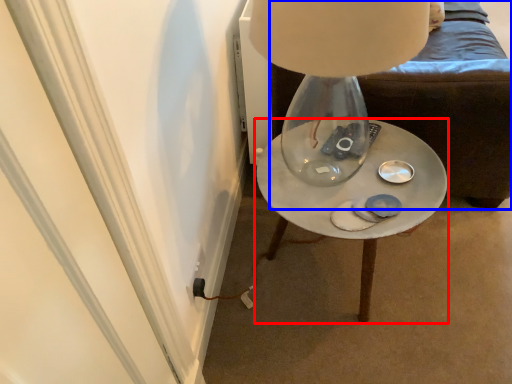
Question: Which object appears farthest to the camera in this image, table (highlighted by a red box) or furniture (highlighted by a blue box)?

Choices:
 (A) table
 (B) furniture

Answer: (A)